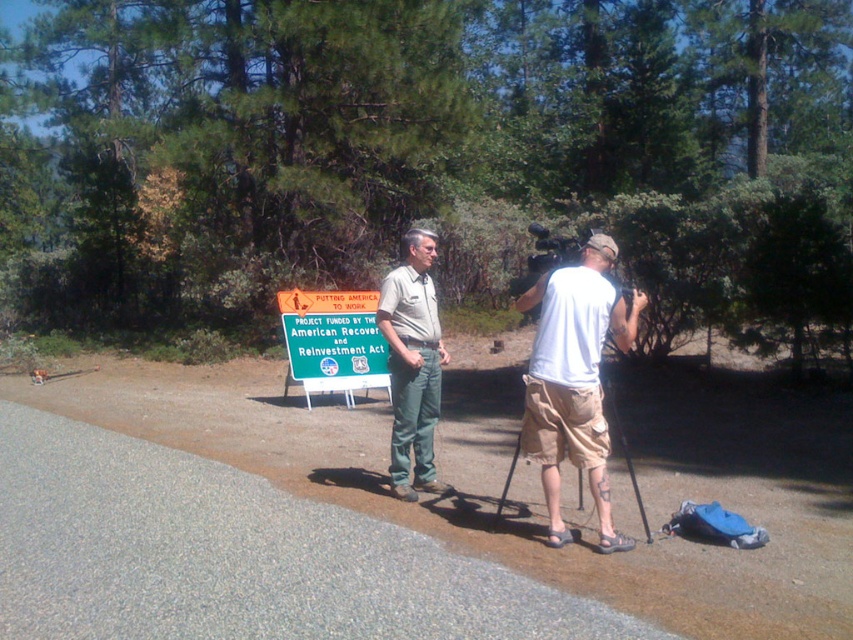
You are a photographer trying to set up a shot. You notice the khaki uniform pants at center and the black metal tripod at center. Which object is positioned higher in the image?

The khaki uniform pants at center is located above the black metal tripod at center, so it is positioned higher in the image.

From the picture: You are a hiker who wants to take a photo of the green matte sign at center. There is a person wearing khaki uniform pants at center blocking your view. Can you move to the left to get a clear shot of the sign without the person in the way?

The khaki uniform pants at center is positioned on the right side of the green matte sign at center. Moving to the left would allow you to position yourself to the left of the person, thus avoiding them blocking the sign.